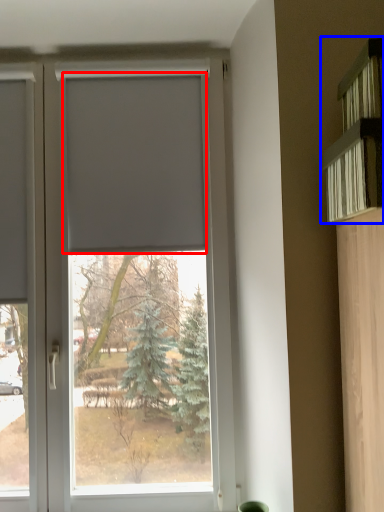
Question: Which object is closer to the camera taking this photo, blind (highlighted by a red box) or shelf (highlighted by a blue box)?

Choices:
 (A) blind
 (B) shelf

Answer: (B)